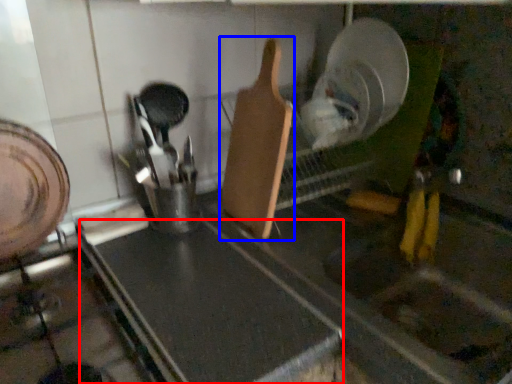
Question: Which of the following is the closest to the observer, counter top (highlighted by a red box) or spatula (highlighted by a blue box)?

Choices:
 (A) counter top
 (B) spatula

Answer: (A)